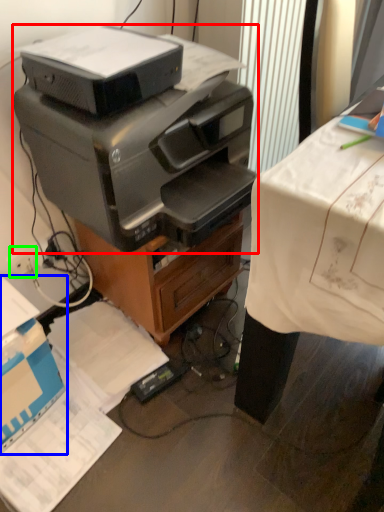
Question: Which is nearer to the printer (highlighted by a red box)? cardboard box (highlighted by a blue box) or plug (highlighted by a green box).

Choices:
 (A) cardboard box
 (B) plug

Answer: (A)